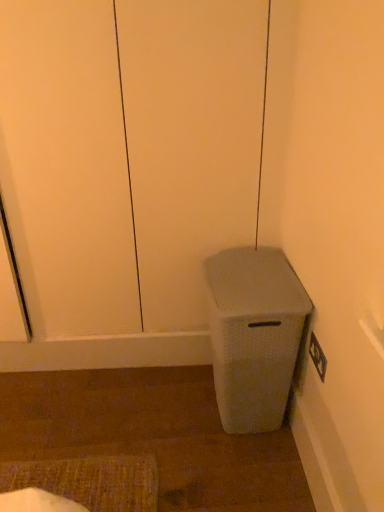
Identify the location of white textured waste bin at lower right. The image size is (384, 512). (254, 335).

What do you see at coordinates (254, 335) in the screenshot?
I see `white textured waste bin at lower right` at bounding box center [254, 335].

Describe the element at coordinates (190, 141) in the screenshot. I see `white textured screen door at lower right` at that location.

What are the coordinates of `white textured screen door at lower right` in the screenshot? It's located at (190, 141).

In order to face white textured screen door at lower right, should I rotate leftwards or rightwards?

Rotate your view left by about 9.844°.

Find the location of `white textured waste bin at lower right`. white textured waste bin at lower right is located at coordinates (254, 335).

Is white textured waste bin at lower right at the left side of white textured screen door at lower right?

No, white textured waste bin at lower right is not to the left of white textured screen door at lower right.

Is white textured waste bin at lower right behind white textured screen door at lower right?

Yes, white textured waste bin at lower right is further from the viewer.

Which is behind, point (240, 413) or point (174, 258)?

The point (174, 258) is farther.

From the image's perspective, which is below, white textured waste bin at lower right or white textured screen door at lower right?

white textured waste bin at lower right is shown below in the image.

From a real-world perspective, is white textured waste bin at lower right below white textured screen door at lower right?

Yes, from a real-world perspective, white textured waste bin at lower right is under white textured screen door at lower right.

Which of these two, white textured waste bin at lower right or white textured screen door at lower right, is wider?

Wider between the two is white textured waste bin at lower right.

Who is taller, white textured waste bin at lower right or white textured screen door at lower right?

white textured screen door at lower right is taller.

Considering the relative sizes of white textured waste bin at lower right and white textured screen door at lower right in the image provided, is white textured waste bin at lower right bigger than white textured screen door at lower right?

No, white textured waste bin at lower right is not bigger than white textured screen door at lower right.

Is white textured waste bin at lower right situated inside white textured screen door at lower right or outside?

white textured waste bin at lower right is not inside white textured screen door at lower right, it's outside.

Is white textured waste bin at lower right in contact with white textured screen door at lower right?

No, white textured waste bin at lower right is not next to white textured screen door at lower right.

Does white textured waste bin at lower right turn towards white textured screen door at lower right?

No, white textured waste bin at lower right is not aimed at white textured screen door at lower right.

Locate an element on the screen. screen door on the left of white textured waste bin at lower right is located at coordinates (190, 141).

Considering the positions of objects white textured screen door at lower right and white textured waste bin at lower right in the image provided, who is more to the right, white textured screen door at lower right or white textured waste bin at lower right?

white textured waste bin at lower right is more to the right.

Is white textured screen door at lower right positioned before white textured waste bin at lower right?

Yes, white textured screen door at lower right is closer to the viewer.

Between point (188, 108) and point (262, 284), which one is positioned behind?

The point (188, 108) is farther from the camera.

From the image's perspective, is white textured screen door at lower right located beneath white textured waste bin at lower right?

Actually, white textured screen door at lower right appears above white textured waste bin at lower right in the image.

From a real-world perspective, is white textured screen door at lower right located higher than white textured waste bin at lower right?

Yes.

Which of these two, white textured screen door at lower right or white textured waste bin at lower right, is wider?

white textured waste bin at lower right.

Based on the photo, considering the sizes of objects white textured screen door at lower right and white textured waste bin at lower right in the image provided, who is taller, white textured screen door at lower right or white textured waste bin at lower right?

With more height is white textured screen door at lower right.

Considering the sizes of objects white textured screen door at lower right and white textured waste bin at lower right in the image provided, who is smaller, white textured screen door at lower right or white textured waste bin at lower right?

white textured waste bin at lower right.

Would you say white textured screen door at lower right is inside or outside white textured waste bin at lower right?

white textured screen door at lower right is not inside white textured waste bin at lower right, it's outside.

Is white textured screen door at lower right far away from white textured waste bin at lower right?

white textured screen door at lower right is actually quite close to white textured waste bin at lower right.

Is white textured screen door at lower right positioned with its back to white textured waste bin at lower right?

Absolutely, white textured screen door at lower right is directed away from white textured waste bin at lower right.

How much distance is there between white textured screen door at lower right and white textured waste bin at lower right?

A distance of 17.91 inches exists between white textured screen door at lower right and white textured waste bin at lower right.

In the image, there is a white textured screen door at lower right. In order to click on waste container below it (from a real-world perspective) in this screenshot , I will do `click(254, 335)`.

Identify the location of waste container that is below the white textured screen door at lower right (from the image's perspective). pos(254,335).

Find the location of a particular element. The width and height of the screenshot is (384, 512). screen door above the white textured waste bin at lower right (from the image's perspective) is located at coordinates (190, 141).